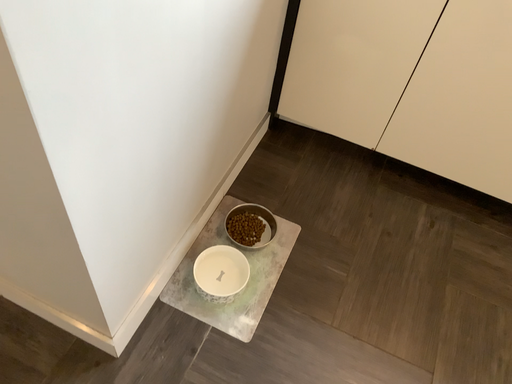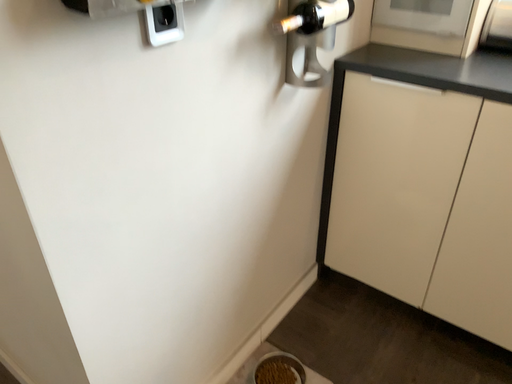
Question: How did the camera likely rotate when shooting the video?

Choices:
 (A) rotated right
 (B) rotated left

Answer: (B)